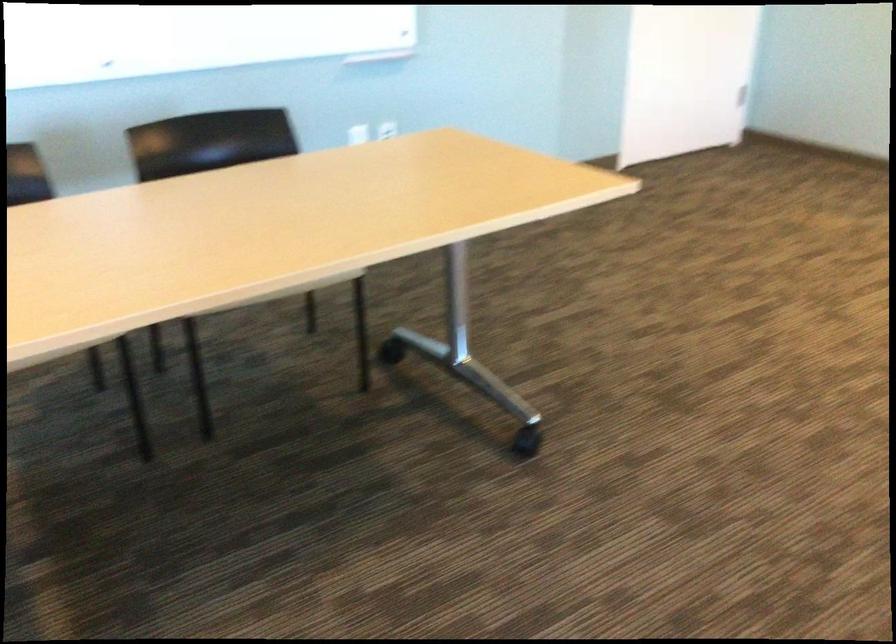
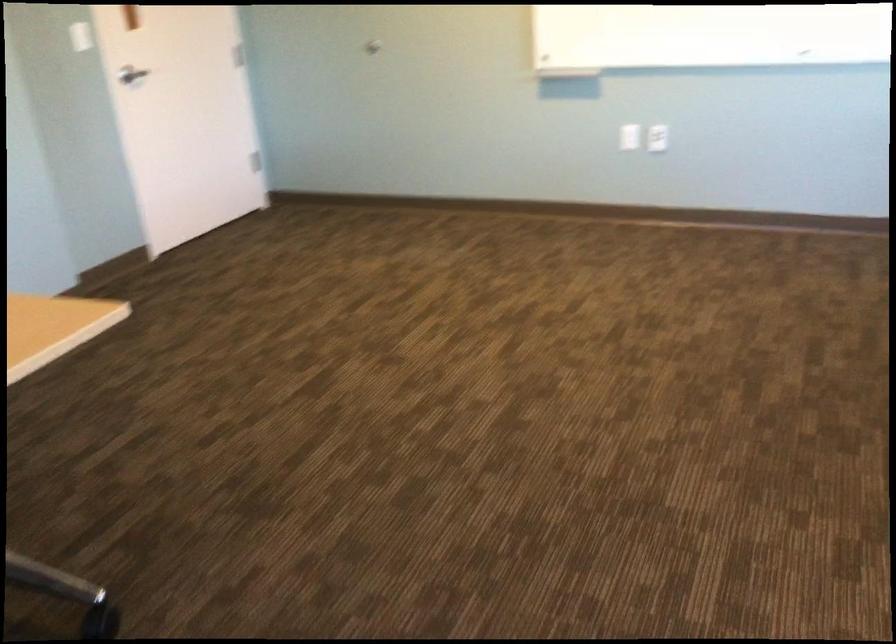
Question: Based on the continuous images, in which direction is the camera rotating? Reply with the corresponding letter.

Choices:
 (A) Left
 (B) Right
 (C) Up
 (D) Down

Answer: (B)